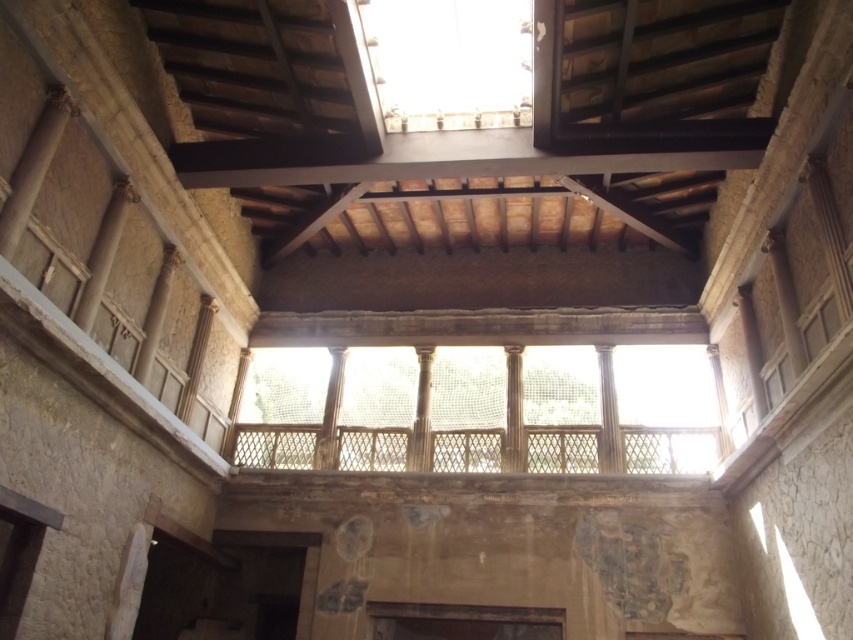
Question: Does translucent wooden lattice at center have a larger size compared to transparent glass window at upper center?

Choices:
 (A) no
 (B) yes

Answer: (B)

Question: Which point is closer to the camera taking this photo?

Choices:
 (A) (485, 58)
 (B) (260, 433)

Answer: (A)

Question: Which object is closer to the camera taking this photo?

Choices:
 (A) translucent wooden lattice at center
 (B) transparent glass window at upper center

Answer: (B)

Question: Does translucent wooden lattice at center come in front of transparent glass window at upper center?

Choices:
 (A) yes
 (B) no

Answer: (B)

Question: Does translucent wooden lattice at center come behind transparent glass window at upper center?

Choices:
 (A) yes
 (B) no

Answer: (A)